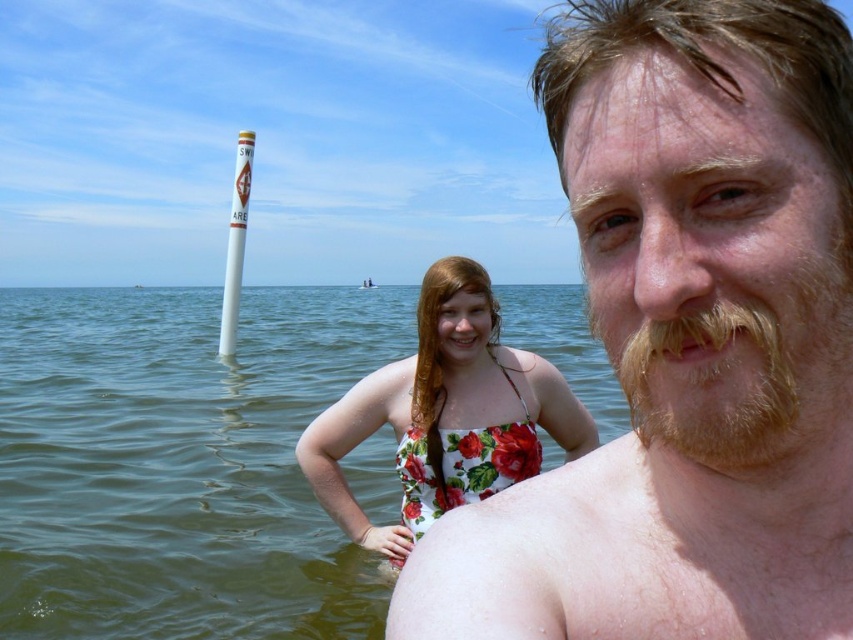
Question: Is shiny blonde hair at upper right to the left of light brown fuzzy beard at right from the viewer's perspective?

Choices:
 (A) yes
 (B) no

Answer: (B)

Question: Which point is farther to the camera?

Choices:
 (A) (424, 436)
 (B) (751, 420)
 (C) (708, 404)
 (D) (521, 566)

Answer: (A)

Question: Which point is closer to the camera?

Choices:
 (A) (596, 582)
 (B) (683, 236)

Answer: (B)

Question: Which is nearer to the greenish water at center?

Choices:
 (A) floral print swimsuit at center
 (B) shiny blonde hair at upper right

Answer: (A)

Question: Is shiny blonde hair at upper right positioned at the back of floral print swimsuit at center?

Choices:
 (A) no
 (B) yes

Answer: (A)

Question: Is greenish water at center closer to camera compared to smooth skin torso at center?

Choices:
 (A) yes
 (B) no

Answer: (B)